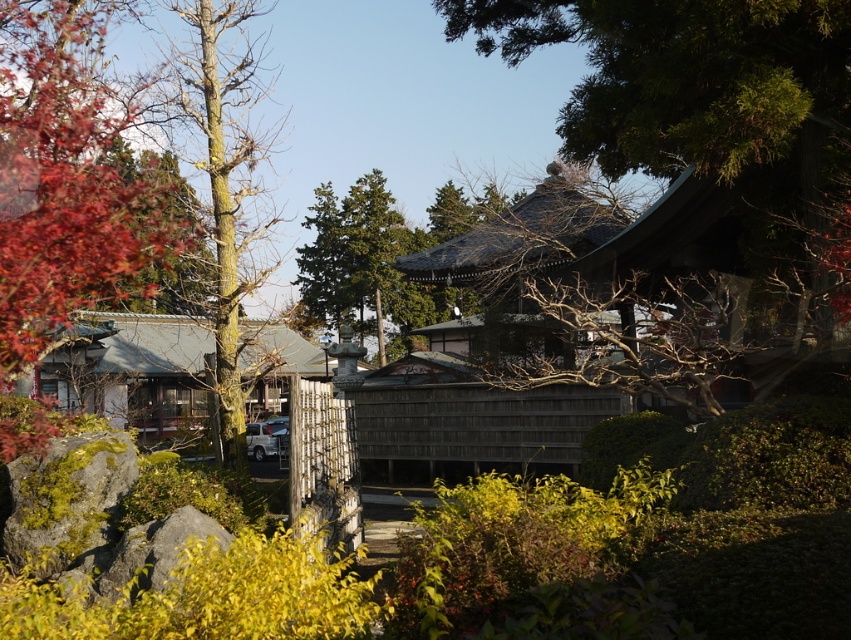
You are standing in a traditional Japanese garden and see the green shingled roof at upper center and the green textured tree at center. Which object is closer to you?

The green shingled roof at upper center is closer to you because it is in front of the green textured tree at center.

You are a visitor at this Japanese temple and want to take a photo that includes both the wooden hut at center and the green textured tree at center. Which object should you position closer to the edge of the frame to ensure both fit in the photo?

Since the wooden hut at center is wider than the green textured tree at center, you should position the wooden hut at center closer to the edge of the frame to ensure both fit in the photo.

You are standing in the Japanese temple grounds and want to take a photo that includes both the green shingled roof at upper center and the green textured tree at center. Given that your camera has a maximum focus range of 30 meters, will you be able to capture both subjects in focus at the same time?

The green shingled roof at upper center is 29.98 meters away from the green textured tree at center. Since the distance between them is within the camera maximum focus range of 30 meters, you can capture both subjects in focus simultaneously.